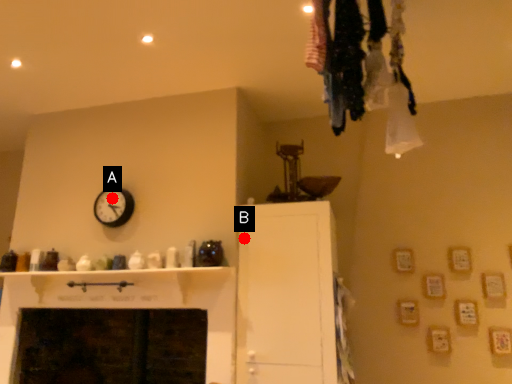
Question: Two points are circled on the image, labeled by A and B beside each circle. Which point is closer to the camera?

Choices:
 (A) A is closer
 (B) B is closer

Answer: (B)